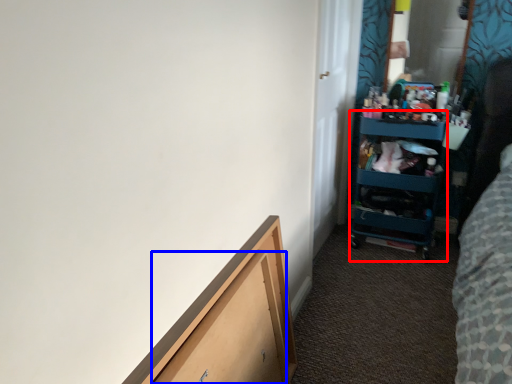
Question: Which of the following is the farthest to the observer, cabinet (highlighted by a red box) or drawer (highlighted by a blue box)?

Choices:
 (A) cabinet
 (B) drawer

Answer: (A)